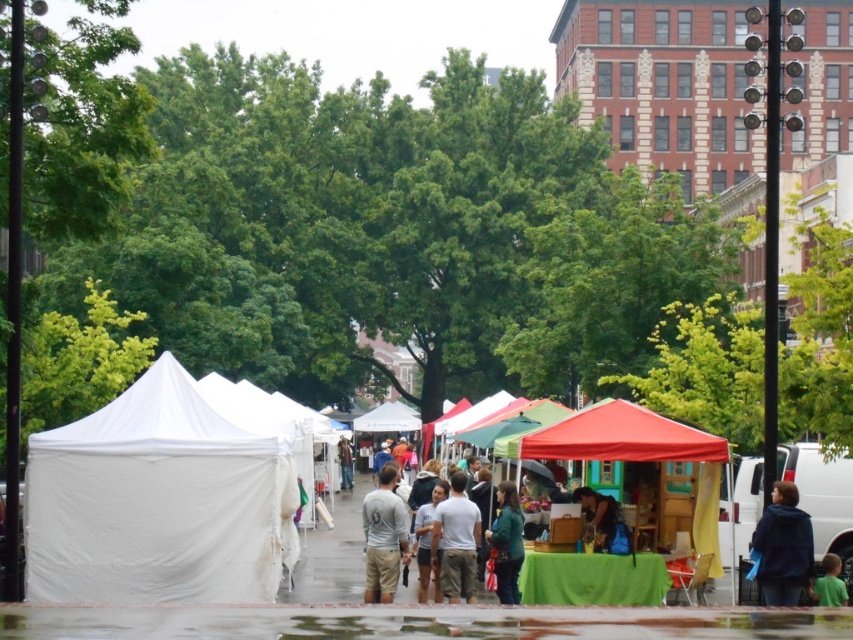
Does light gray cotton shirt at center have a larger size compared to green fabric at lower right?

Indeed, light gray cotton shirt at center has a larger size compared to green fabric at lower right.

Is light gray cotton shirt at center wider than green fabric at lower right?

Yes.

You are a GUI agent. You are given a task and a screenshot of the screen. Output one action in this format:
    pyautogui.click(x=<x>, y=<y>)
    Task: Click on the light gray cotton shirt at center
    
    Given the screenshot: What is the action you would take?
    pyautogui.click(x=427, y=541)

What do you see at coordinates (618, 436) in the screenshot? I see `red fabric canopy at center` at bounding box center [618, 436].

This screenshot has height=640, width=853. Identify the location of red fabric canopy at center. (618, 436).

Is green fabric at lower center to the left of light brown cotton pants at center from the viewer's perspective?

Yes, green fabric at lower center is to the left of light brown cotton pants at center.

Between point (187, 632) and point (447, 516), which one is positioned behind?

Positioned behind is point (447, 516).

Between point (701, 636) and point (456, 547), which one is positioned behind?

Positioned behind is point (456, 547).

The image size is (853, 640). Find the location of `green fabric at lower center`. green fabric at lower center is located at coordinates (418, 621).